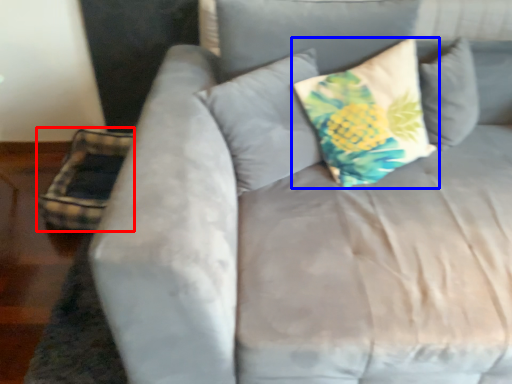
Question: Which point is closer to the camera, pillow (highlighted by a red box) or pillow (highlighted by a blue box)?

Choices:
 (A) pillow
 (B) pillow

Answer: (B)